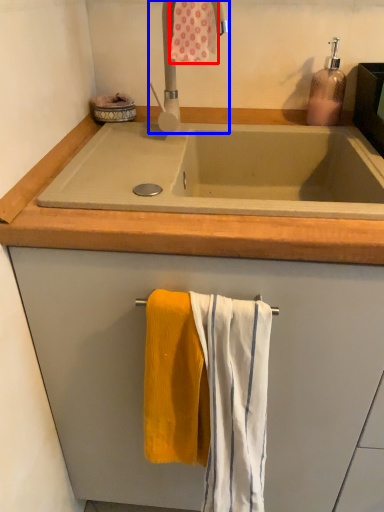
Question: Which point is further to the camera, bath towel (highlighted by a red box) or tap (highlighted by a blue box)?

Choices:
 (A) bath towel
 (B) tap

Answer: (A)